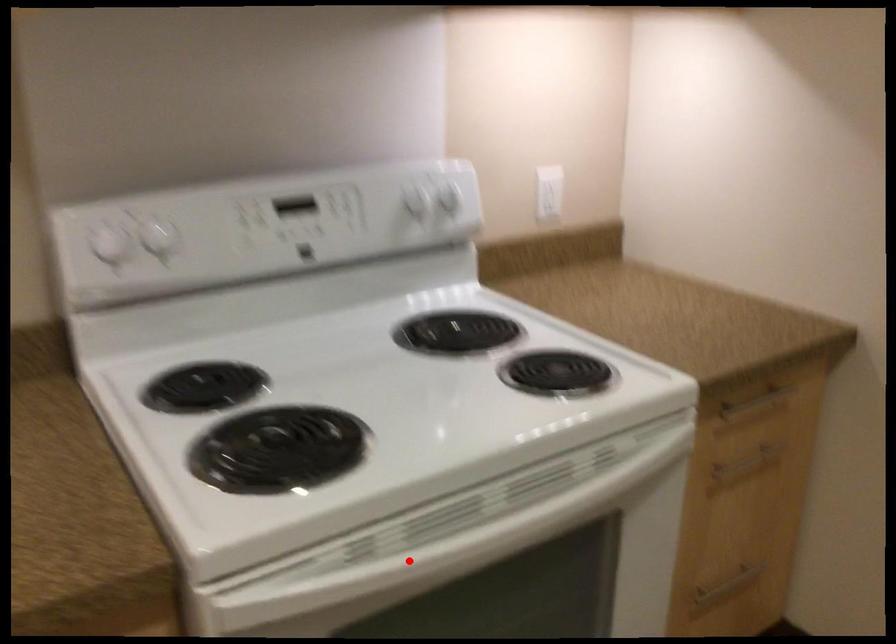
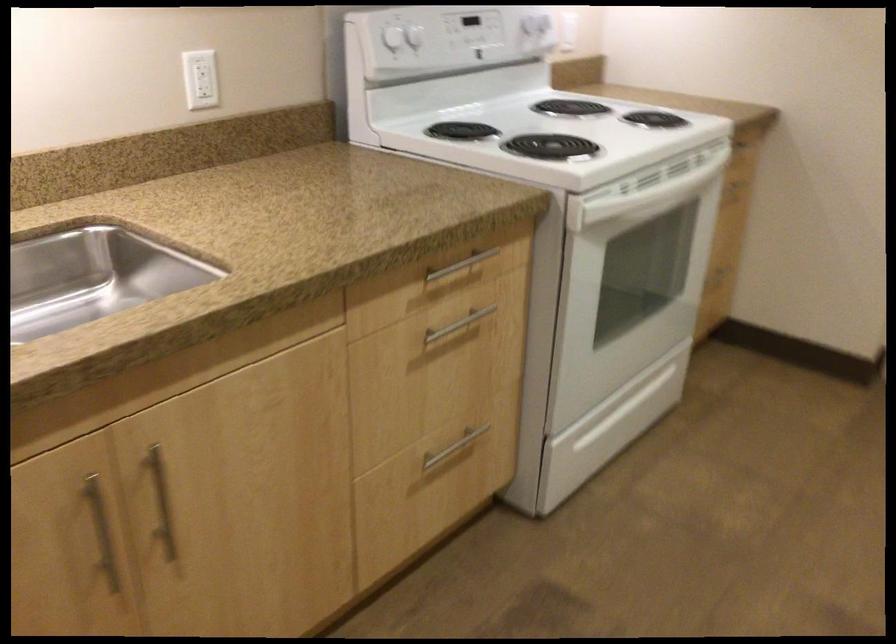
Question: I am providing you with two images of the same scene from different viewpoints. In image1, a red point is highlighted. Considering the same 3D point in image2, which of the following is correct?

Choices:
 (A) It is closer
 (B) It is farther

Answer: (B)